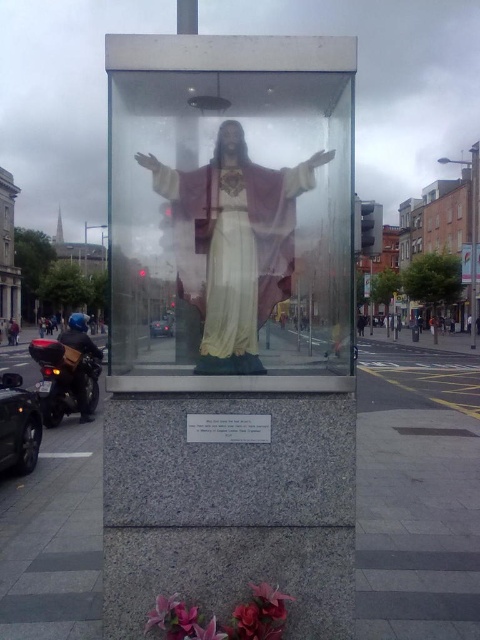
Does shiny black motorcycle at lower left come behind red leather jacket at lower left?

No, it is in front of red leather jacket at lower left.

Between point (50, 348) and point (17, 336), which one is positioned behind?

Positioned behind is point (17, 336).

Locate an element on the screen. This screenshot has height=640, width=480. shiny black motorcycle at lower left is located at coordinates (67, 376).

Who is more forward, (263, 285) or (19, 328)?

Point (263, 285) is in front.

Which is behind, point (275, 248) or point (14, 332)?

The point (14, 332) is more distant.

This screenshot has width=480, height=640. I want to click on matte gold statue at center, so click(x=232, y=243).

Between matte gold statue at center and shiny black motorcycle at lower left, which one appears on the right side from the viewer's perspective?

From the viewer's perspective, matte gold statue at center appears more on the right side.

Is matte gold statue at center below shiny black motorcycle at lower left?

Actually, matte gold statue at center is above shiny black motorcycle at lower left.

Which is in front, point (218, 310) or point (60, 340)?

Point (218, 310)

Where is `matte gold statue at center`? This screenshot has height=640, width=480. matte gold statue at center is located at coordinates (232, 243).